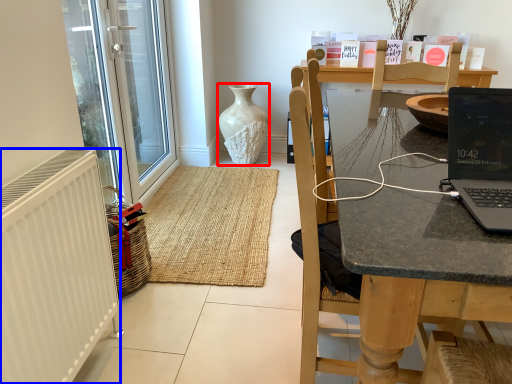
Question: Which object is closer to the camera taking this photo, vase (highlighted by a red box) or radiator (highlighted by a blue box)?

Choices:
 (A) vase
 (B) radiator

Answer: (B)